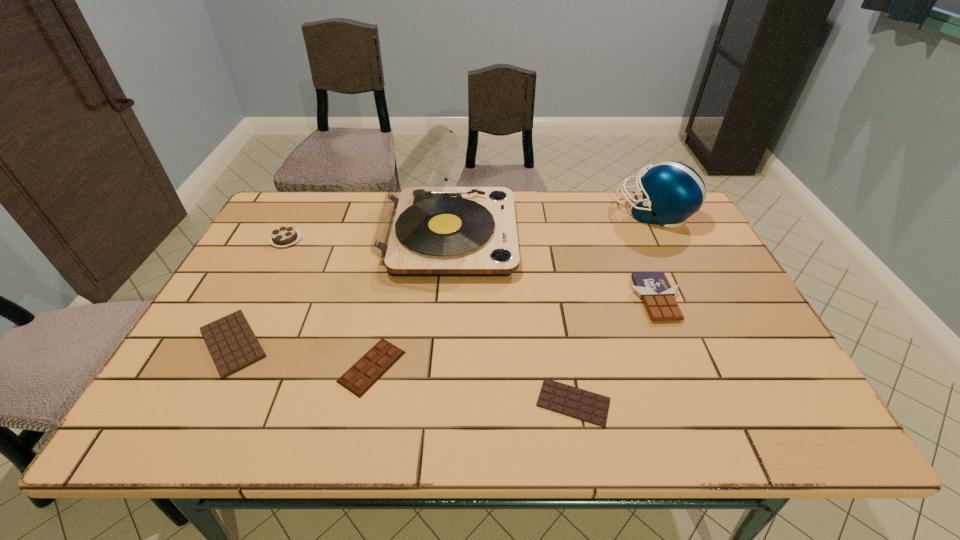
You are a GUI agent. You are given a task and a screenshot of the screen. Output one action in this format:
    pyautogui.click(x=<x>, y=<y>)
    Task: Click on the football helmet that is at the far edge
    This screenshot has width=960, height=540.
    Given the screenshot: What is the action you would take?
    pyautogui.click(x=672, y=191)

Locate an element on the screen. The image size is (960, 540). chocolate cake located in the far edge section of the desktop is located at coordinates (283, 236).

At what (x,y) coordinates should I click in order to perform the action: click on chocolate cake that is at the left edge. Please return your answer as a coordinate pair (x, y). Looking at the image, I should click on (283, 236).

At what (x,y) coordinates should I click in order to perform the action: click on chocolate bar located at the left edge. Please return your answer as a coordinate pair (x, y). This screenshot has height=540, width=960. Looking at the image, I should click on (233, 345).

What are the coordinates of `football helmet at the right edge` in the screenshot? It's located at (672, 191).

You are a GUI agent. You are given a task and a screenshot of the screen. Output one action in this format:
    pyautogui.click(x=<x>, y=<y>)
    Task: Click on the chocolate bar situated at the right edge
    This screenshot has width=960, height=540.
    Given the screenshot: What is the action you would take?
    pyautogui.click(x=654, y=288)

You are a GUI agent. You are given a task and a screenshot of the screen. Output one action in this format:
    pyautogui.click(x=<x>, y=<y>)
    Task: Click on the object at the far left corner
    The image size is (960, 540).
    Given the screenshot: What is the action you would take?
    pyautogui.click(x=283, y=236)

You are a GUI agent. You are given a task and a screenshot of the screen. Output one action in this format:
    pyautogui.click(x=<x>, y=<y>)
    Task: Click on the object that is at the far right corner
    
    Given the screenshot: What is the action you would take?
    pyautogui.click(x=672, y=191)

Identify the location of vacant space at the near edge of the desktop. (500, 415).

Image resolution: width=960 pixels, height=540 pixels. Find the location of `free region at the left edge`. free region at the left edge is located at coordinates (274, 315).